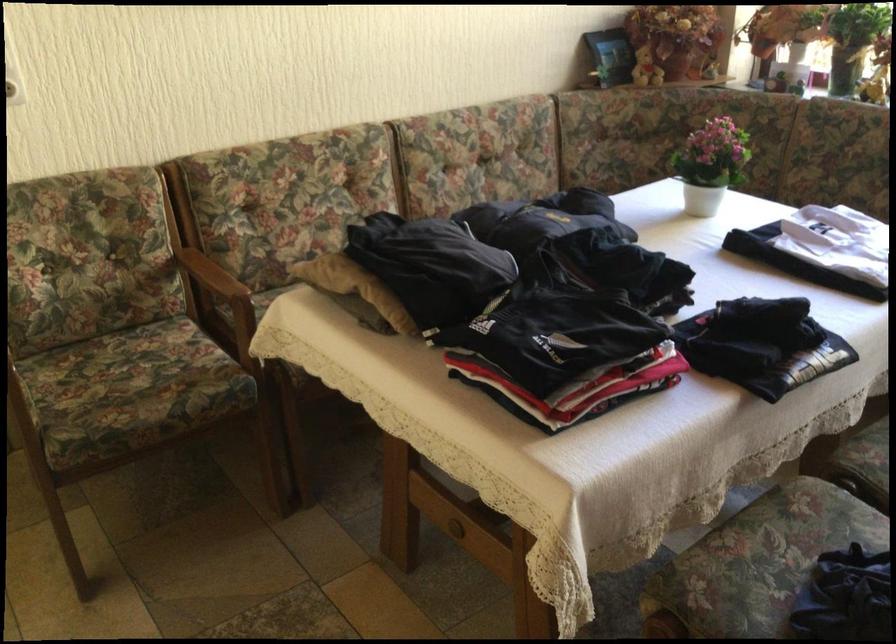
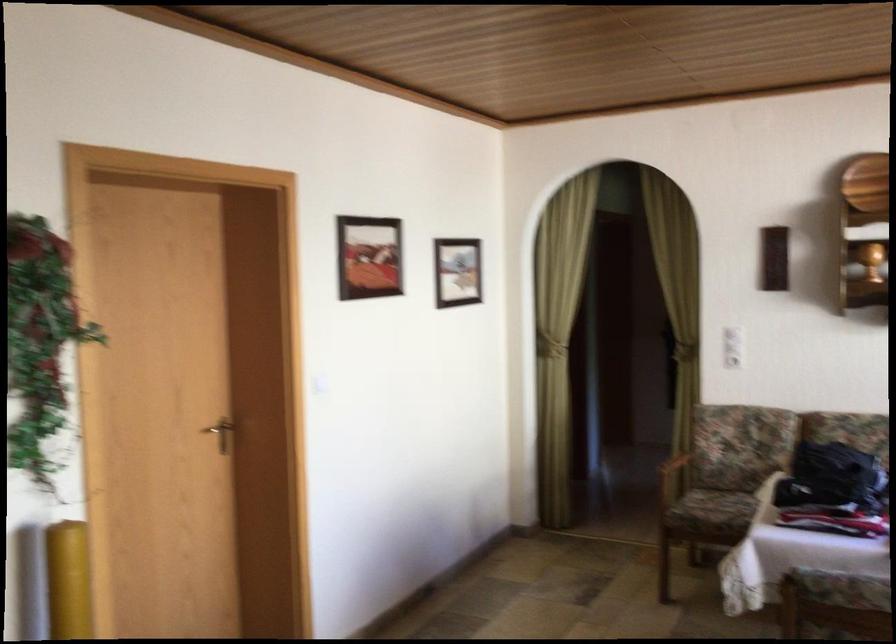
Question: I am providing you with two images of the same scene from different viewpoints. Please identify which objects are invisible in image2.

Choices:
 (A) wooden chair armrest
 (B) black bag
 (C) scraper handle
 (D) chair armrest

Answer: (A)